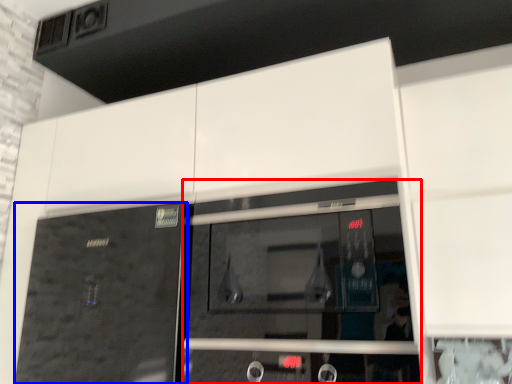
Question: Among these objects, which one is nearest to the camera, screen door (highlighted by a red box) or door (highlighted by a blue box)?

Choices:
 (A) screen door
 (B) door

Answer: (A)